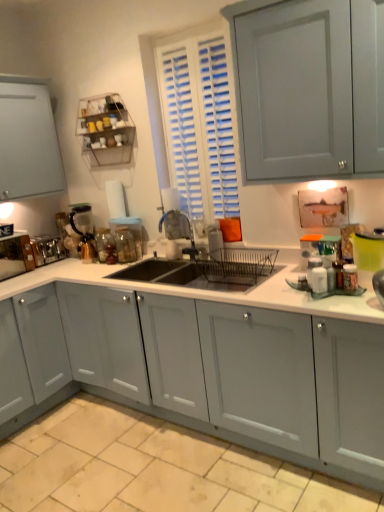
The image size is (384, 512). Describe the element at coordinates (152, 468) in the screenshot. I see `beige tile at lower center` at that location.

The width and height of the screenshot is (384, 512). Describe the element at coordinates (126, 238) in the screenshot. I see `clear glass jar at sink, the 1th appliance when ordered from right to left` at that location.

Identify the location of metallic blue faucet at center. (178, 229).

What is the approximate width of satin silver toaster at left, which is the 3th appliance from right to left?

satin silver toaster at left, which is the 3th appliance from right to left, is 3.08 inches wide.

This screenshot has width=384, height=512. What are the coordinates of `metal wire rack at upper left` in the screenshot? It's located at (105, 130).

Locate an element on the screen. Image resolution: width=384 pixels, height=512 pixels. white matte countertop at center is located at coordinates (217, 362).

Between metallic silver toaster at left, the first appliance when ordered from left to right, and satin silver toaster at left, which is the 3th appliance from right to left, which one is positioned in front?

metallic silver toaster at left, the first appliance when ordered from left to right, is in front.

Considering the relative sizes of metallic silver toaster at left, the fourth appliance from the right, and satin silver toaster at left, which is the 3th appliance from right to left, in the image provided, is metallic silver toaster at left, the fourth appliance from the right, smaller than satin silver toaster at left, which is the 3th appliance from right to left,?

No, metallic silver toaster at left, the fourth appliance from the right, is not smaller than satin silver toaster at left, which is the 3th appliance from right to left.

Measure the distance from clear glass jar at sink, the 1th appliance when ordered from right to left, to metallic blue faucet at center.

clear glass jar at sink, the 1th appliance when ordered from right to left, and metallic blue faucet at center are 12.24 inches apart from each other.

Based on the photo, is clear glass jar at sink, the 1th appliance when ordered from right to left, placed right next to metallic blue faucet at center?

clear glass jar at sink, the 1th appliance when ordered from right to left, and metallic blue faucet at center are clearly separated.

Identify the location of faucet lying on the right of clear glass jar at sink, placed as the fourth appliance when sorted from left to right. The image size is (384, 512). (178, 229).

Is clear glass jar at sink, placed as the fourth appliance when sorted from left to right, inside the boundaries of metallic blue faucet at center, or outside?

clear glass jar at sink, placed as the fourth appliance when sorted from left to right, is not enclosed by metallic blue faucet at center.

From the image's perspective, relative to white matte countertop at center, is metallic silver toaster at left, the fourth appliance from the right, above or below?

Clearly, from the image's perspective, metallic silver toaster at left, the fourth appliance from the right, is above white matte countertop at center.

Can you confirm if metallic silver toaster at left, the first appliance when ordered from left to right, is taller than white matte countertop at center?

No, metallic silver toaster at left, the first appliance when ordered from left to right, is not taller than white matte countertop at center.

Which is more to the right, metallic silver toaster at left, the fourth appliance from the right, or white matte countertop at center?

white matte countertop at center is more to the right.

Are metallic silver toaster at left, the fourth appliance from the right, and white matte countertop at center making contact?

No, metallic silver toaster at left, the fourth appliance from the right, is not touching white matte countertop at center.

Can you confirm if beige tile at lower center is shorter than clear glass jar at sink, placed as the fourth appliance when sorted from left to right?

Yes.

Is beige tile at lower center not inside clear glass jar at sink, the 1th appliance when ordered from right to left?

That's correct, beige tile at lower center is outside of clear glass jar at sink, the 1th appliance when ordered from right to left.

From a real-world perspective, between beige tile at lower center and clear glass jar at sink, the 1th appliance when ordered from right to left, who is vertically higher?

In real-world perspective, clear glass jar at sink, the 1th appliance when ordered from right to left, is above.

Is white matte countertop at center oriented away from metal wire rack at upper left?

No, white matte countertop at center is not facing the opposite direction of metal wire rack at upper left.

Choose the correct answer: Is white matte countertop at center inside metal wire rack at upper left or outside it?

white matte countertop at center is not enclosed by metal wire rack at upper left.

From the image's perspective, which one is positioned lower, white matte countertop at center or metal wire rack at upper left?

white matte countertop at center.

Is point (329, 397) positioned in front of point (77, 131)?

Yes, it is in front of point (77, 131).

From a real-world perspective, is satin silver toaster at left, the second appliance from the left, positioned under metallic silver toaster at left, the fourth appliance from the right, based on gravity?

Yes, from a real-world perspective, satin silver toaster at left, the second appliance from the left, is under metallic silver toaster at left, the fourth appliance from the right.

In the image, is satin silver toaster at left, the second appliance from the left, positioned in front of or behind metallic silver toaster at left, the fourth appliance from the right?

Visually, satin silver toaster at left, the second appliance from the left, is located behind metallic silver toaster at left, the fourth appliance from the right.

Considering the positions of point (45, 254) and point (13, 238), is point (45, 254) closer or farther from the camera than point (13, 238)?

Point (45, 254) appears to be farther away from the viewer than point (13, 238).

Which object is positioned more to the left, satin silver toaster at left, the second appliance from the left, or metallic silver toaster at left, the fourth appliance from the right?

From the viewer's perspective, metallic silver toaster at left, the fourth appliance from the right, appears more on the left side.

From a real-world perspective, who is located higher, beige tile at lower center or metallic blue faucet at center?

metallic blue faucet at center, from a real-world perspective.

Would you say metallic blue faucet at center is part of beige tile at lower center's contents?

Definitely not — metallic blue faucet at center is not inside beige tile at lower center.

Where is `tile that is below the metallic blue faucet at center (from the image's perspective)`? The image size is (384, 512). tile that is below the metallic blue faucet at center (from the image's perspective) is located at coordinates (152, 468).

Is beige tile at lower center not near metallic blue faucet at center?

Yes, beige tile at lower center and metallic blue faucet at center are quite far apart.

Identify the location of the 1st appliance above the metallic silver toaster at left, the first appliance when ordered from left to right (from the image's perspective). (47, 249).

Identify the location of the 1st appliance below when counting from the metallic blue faucet at center (from the image's perspective). This screenshot has width=384, height=512. (126, 238).

Looking at the image, which one is located further to satin silver toaster at left, which is the 3th appliance from right to left, metallic blue faucet at center or clear glass jar at sink, placed as the fourth appliance when sorted from left to right?

metallic blue faucet at center is further to satin silver toaster at left, which is the 3th appliance from right to left.

Which object lies further to the anchor point white matte countertop at center, metallic silver toaster at left, the fourth appliance from the right, or satin silver toaster at left, which is the 3th appliance from right to left?

Based on the image, satin silver toaster at left, which is the 3th appliance from right to left, appears to be further to white matte countertop at center.

When comparing their distances from metal wire rack at upper left, does satin silver toaster at left, the second appliance from the left, or clear glass jar at sink, the 1th appliance when ordered from right to left, seem further?

The object further to metal wire rack at upper left is satin silver toaster at left, the second appliance from the left.

Looking at the image, which one is located further to white matte countertop at center, metallic silver toaster at left, the fourth appliance from the right, or metal wire rack at upper left?

Based on the image, metal wire rack at upper left appears to be further to white matte countertop at center.

Which object lies further to the anchor point metallic blue faucet at center, beige tile at lower center or white matte countertop at center?

Based on the image, beige tile at lower center appears to be further to metallic blue faucet at center.

Based on their spatial positions, is white matte countertop at center or satin silver toaster at left, the second appliance from the left, further from beige tile at lower center?

satin silver toaster at left, the second appliance from the left.

Which object lies nearer to the anchor point clear glass jar at sink, the 1th appliance when ordered from right to left, metallic blue faucet at center or satin silver toaster at left, which is the 3th appliance from right to left?

metallic blue faucet at center lies closer to clear glass jar at sink, the 1th appliance when ordered from right to left, than the other object.

Estimate the real-world distances between objects in this image. Which object is further from translucent glass coffee maker at left, which is the second appliance from right to left, white matte countertop at center or metallic blue faucet at center?

white matte countertop at center lies further to translucent glass coffee maker at left, which is the second appliance from right to left, than the other object.

This screenshot has width=384, height=512. In order to click on faucet positioned between beige tile at lower center and metallic silver toaster at left, the fourth appliance from the right, from near to far in this screenshot , I will do `click(178, 229)`.

Locate an element on the screen. The image size is (384, 512). faucet between beige tile at lower center and clear glass jar at sink, placed as the fourth appliance when sorted from left to right, along the z-axis is located at coordinates (178, 229).

At what (x,y) coordinates should I click in order to perform the action: click on countertop located between beige tile at lower center and satin silver toaster at left, the second appliance from the left, in the depth direction. Please return your answer as a coordinate pair (x, y). This screenshot has height=512, width=384. Looking at the image, I should click on (217, 362).

This screenshot has width=384, height=512. In order to click on faucet between metal wire rack at upper left and beige tile at lower center from top to bottom in this screenshot , I will do `click(178, 229)`.